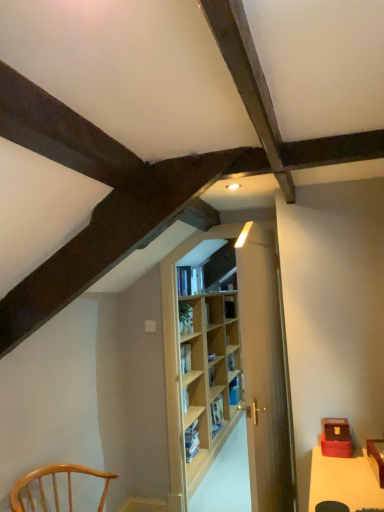
Question: Is blue hardcover book at center, placed as the second book when sorted from front to back, positioned before hardcover book at center, the first book positioned from the left?

Choices:
 (A) no
 (B) yes

Answer: (A)

Question: Could you tell me if blue hardcover book at center, which is the first book in right-to-left order, is turned towards hardcover book at center, which appears as the second book when viewed from the right?

Choices:
 (A) no
 (B) yes

Answer: (A)

Question: Can you confirm if blue hardcover book at center, placed as the second book when sorted from front to back, is wider than hardcover book at center, which is the second book in back-to-front order?

Choices:
 (A) yes
 (B) no

Answer: (B)

Question: From the image's perspective, is blue hardcover book at center, positioned as the 2th book in top-to-bottom order, over hardcover book at center, which is the second book in back-to-front order?

Choices:
 (A) no
 (B) yes

Answer: (A)

Question: Considering the positions of blue hardcover book at center, which ranks as the first book in back-to-front order, and wooden door at center in the image, is blue hardcover book at center, which ranks as the first book in back-to-front order, taller or shorter than wooden door at center?

Choices:
 (A) short
 (B) tall

Answer: (A)

Question: Is blue hardcover book at center, which ranks as the first book in back-to-front order, spatially inside wooden door at center, or outside of it?

Choices:
 (A) inside
 (B) outside

Answer: (B)

Question: Considering the relative positions of blue hardcover book at center, which is the 1th book in bottom-to-top order, and wooden door at center in the image provided, is blue hardcover book at center, which is the 1th book in bottom-to-top order, to the left or to the right of wooden door at center?

Choices:
 (A) right
 (B) left

Answer: (A)

Question: Considering their positions, is blue hardcover book at center, placed as the second book when sorted from front to back, located in front of or behind wooden door at center?

Choices:
 (A) front
 (B) behind

Answer: (B)

Question: In the image, is hardcover book at center, positioned as the first book in top-to-bottom order, positioned in front of or behind light brown wooden chair at lower left?

Choices:
 (A) front
 (B) behind

Answer: (B)

Question: Considering the positions of point (192, 289) and point (18, 496), is point (192, 289) closer or farther from the camera than point (18, 496)?

Choices:
 (A) closer
 (B) farther

Answer: (B)

Question: Is hardcover book at center, which is the second book in back-to-front order, bigger or smaller than light brown wooden chair at lower left?

Choices:
 (A) big
 (B) small

Answer: (B)

Question: Considering the positions of hardcover book at center, which appears as the second book when viewed from the right, and light brown wooden chair at lower left in the image, is hardcover book at center, which appears as the second book when viewed from the right, taller or shorter than light brown wooden chair at lower left?

Choices:
 (A) short
 (B) tall

Answer: (A)

Question: Choose the correct answer: Is wooden door at center inside light brown wooden chair at lower left or outside it?

Choices:
 (A) outside
 (B) inside

Answer: (A)

Question: Considering the relative positions of wooden door at center and light brown wooden chair at lower left in the image provided, is wooden door at center to the left or to the right of light brown wooden chair at lower left?

Choices:
 (A) left
 (B) right

Answer: (B)